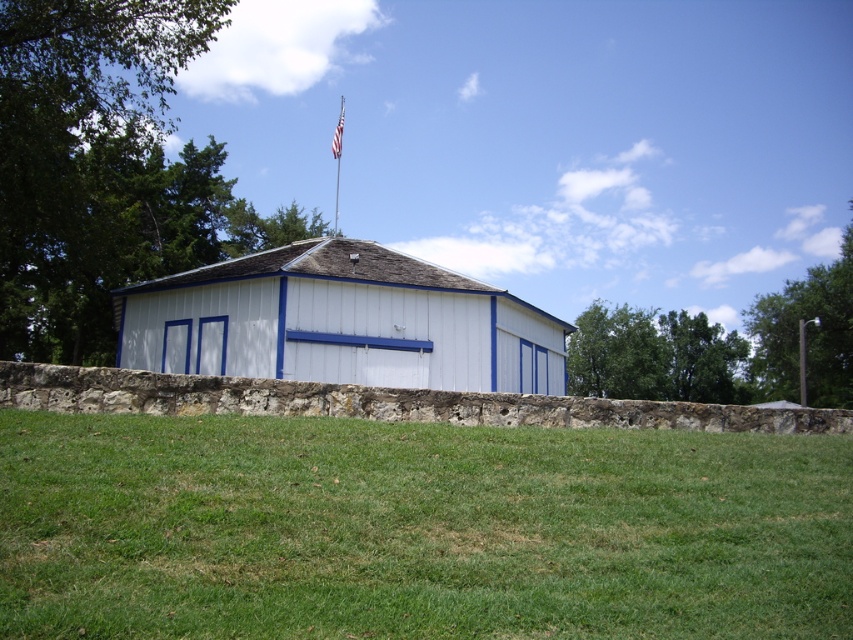
You are standing in front of the building and want to move from the flagpole to the shed. Which direction should you walk to get from the white fabric flag at upper center to the white wood shed at center?

You should walk to the left because the white wood shed at center is to the right of the white fabric flag at upper center, so moving left from the flag will lead you towards the shed.

You are a gardener who wants to mow the green grass at lower center. However, you notice the white wood shed at center is in the way. Can you mow the grass without moving the shed?

The green grass at lower center has a lesser height compared to white wood shed at center, so yes, you can mow the green grass at lower center without moving the shed since the shed is taller and won

You are planning to place a picnic blanket on the green grass at lower center. Considering the space available, can the white wood shed at center be fully visible from the blanket?

The green grass at lower center has a lesser width compared to the white wood shed at center, so placing the picnic blanket there would allow the shed to be fully visible since the grass area is narrower than the shed itself.